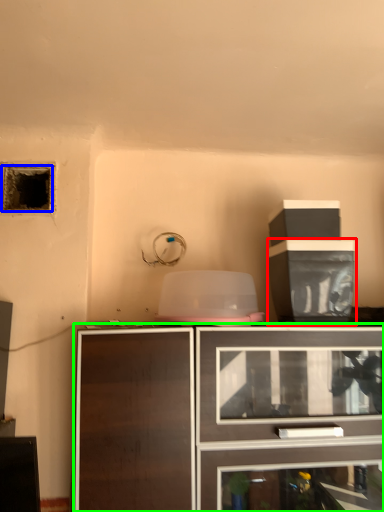
Question: Which object is the farthest from cabinetry (highlighted by a red box)? Choose among these: hole (highlighted by a blue box) or cabinetry (highlighted by a green box).

Choices:
 (A) hole
 (B) cabinetry

Answer: (A)